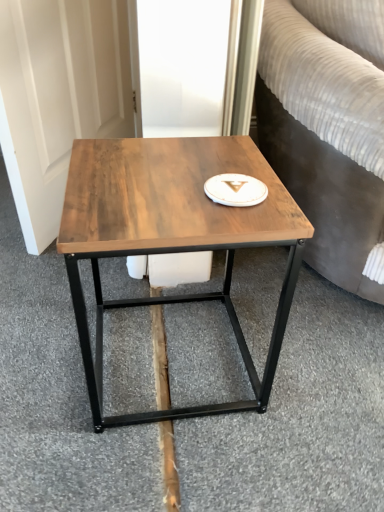
Identify the location of vacant point to the left of white glossy platter at center. (136, 189).